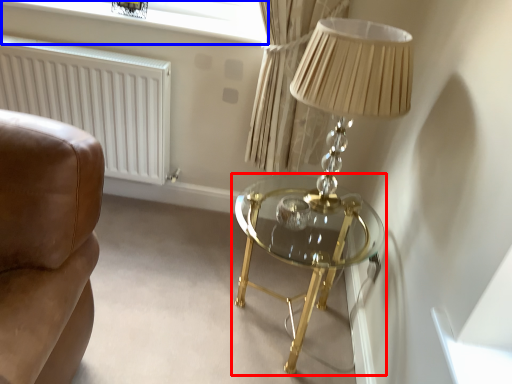
Question: Which object appears closest to the camera in this image, table (highlighted by a red box) or window screen (highlighted by a blue box)?

Choices:
 (A) table
 (B) window screen

Answer: (A)